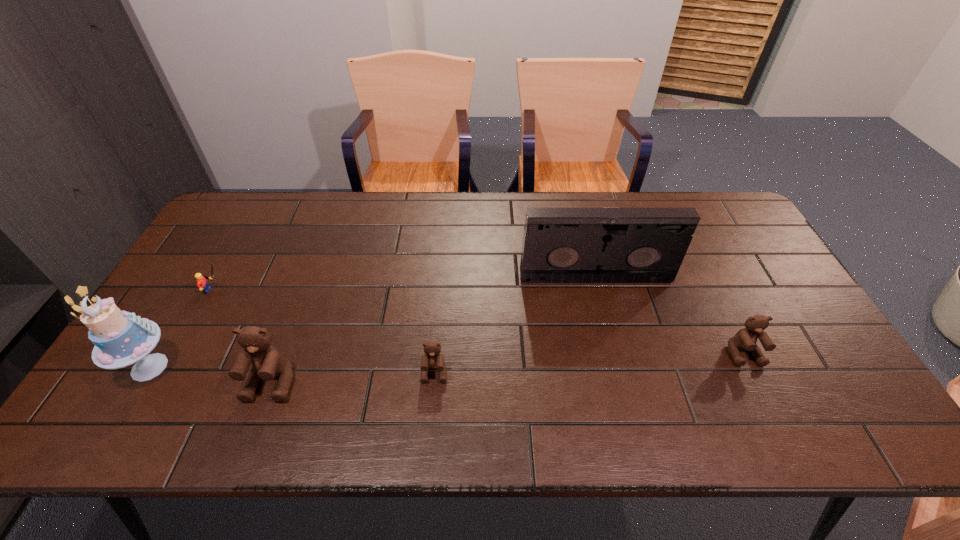
Please determine a free point for an extra teddy_bear to ensure balance. Please provide its 2D coordinates. Your answer should be formatted as a tuple, i.e. [(x, y)], where the tuple contains the x and y coordinates of a point satisfying the conditions above.

[(591, 363)]